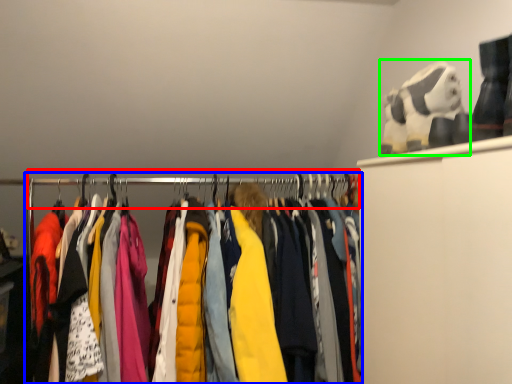
Question: Which object is positioned closest to clothesline (highlighted by a red box)? Select from closet (highlighted by a blue box) and toy (highlighted by a green box).

Choices:
 (A) closet
 (B) toy

Answer: (A)